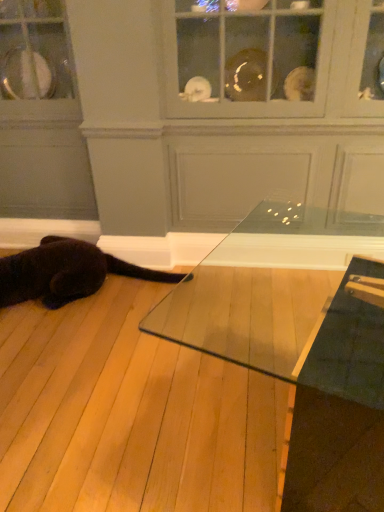
What do you see at coordinates (299, 341) in the screenshot? I see `transparent glass table at lower left` at bounding box center [299, 341].

This screenshot has height=512, width=384. Identify the location of transparent glass table at lower left. (299, 341).

The height and width of the screenshot is (512, 384). Identify the location of transparent glass table at lower left. (299, 341).